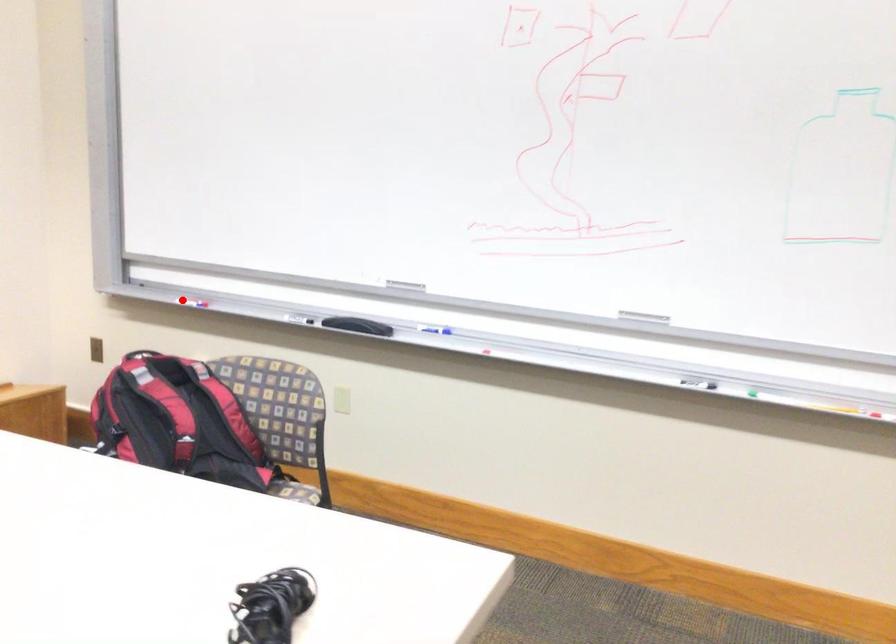
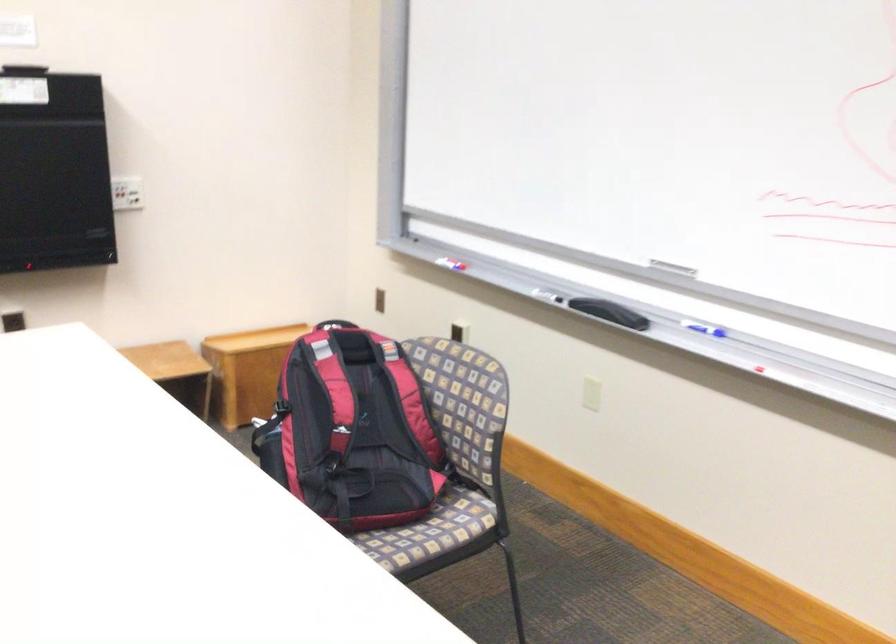
Locate, in the second image, the point that corresponds to the highlighted location in the first image.

(451, 261)